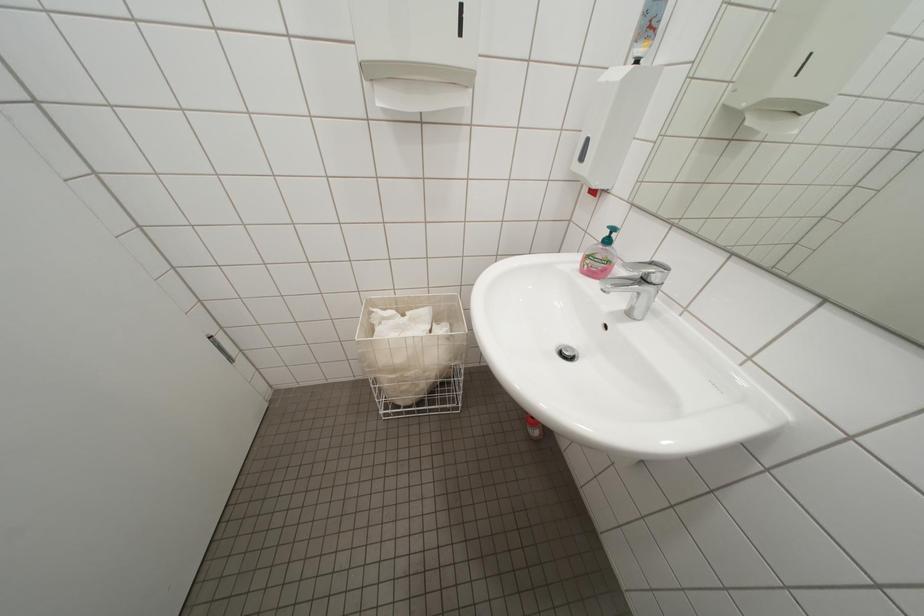
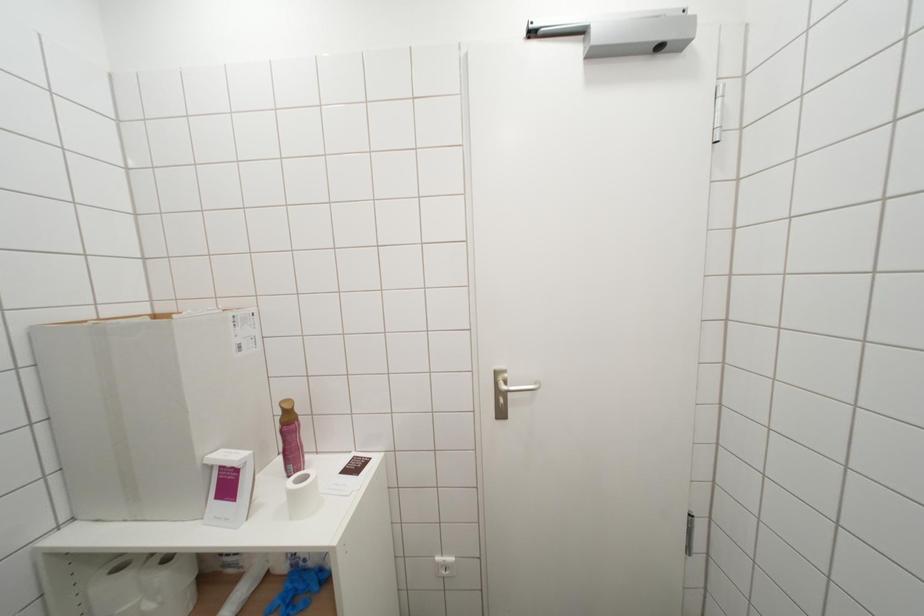
Question: How did the camera likely rotate?

Choices:
 (A) Left
 (B) Right
 (C) Up
 (D) Down

Answer: (A)